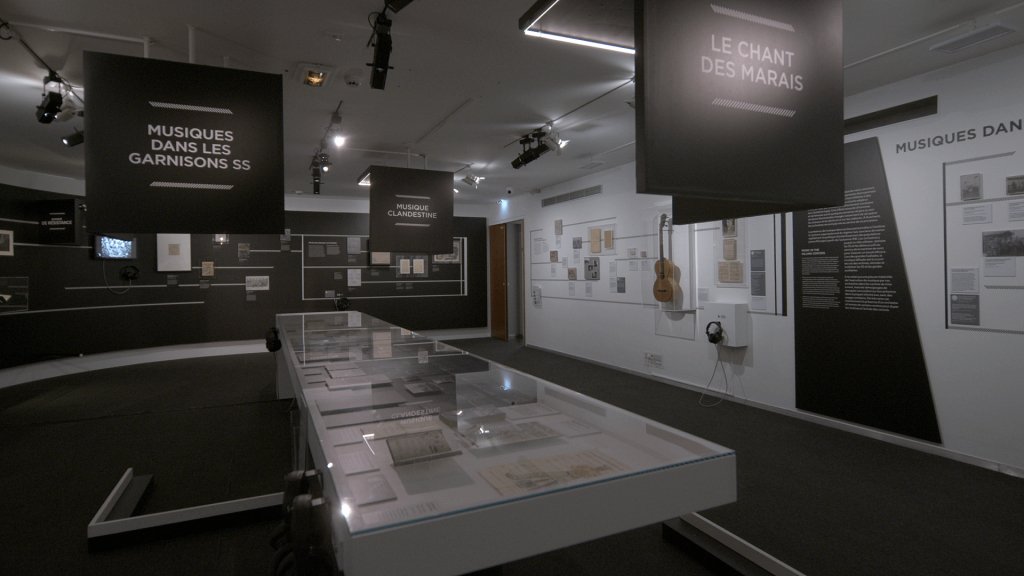
Locate an element on the screen. ceiling is located at coordinates (496, 55).